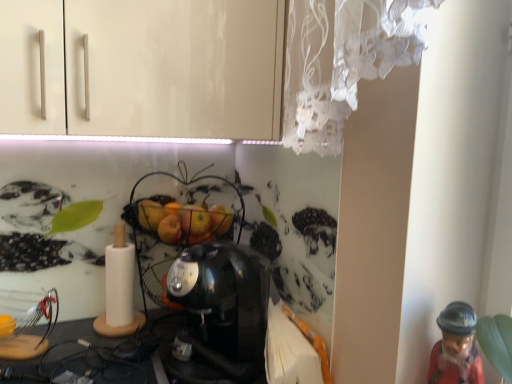
The width and height of the screenshot is (512, 384). What do you see at coordinates (205, 283) in the screenshot?
I see `metallic wire basket at center` at bounding box center [205, 283].

The width and height of the screenshot is (512, 384). Describe the element at coordinates (456, 347) in the screenshot. I see `red glossy figurine at lower right` at that location.

This screenshot has width=512, height=384. What are the coordinates of `metallic wire basket at center` in the screenshot? It's located at (x=205, y=283).

Is metallic wire basket at center oriented towards red glossy figurine at lower right?

Yes.

In the scene shown: Does metallic wire basket at center lie behind red glossy figurine at lower right?

Yes, metallic wire basket at center is behind red glossy figurine at lower right.

Does metallic wire basket at center have a larger size compared to red glossy figurine at lower right?

Yes.

What are the coordinates of `person on the right side of satin black coffee maker at center` in the screenshot? It's located at (456, 347).

Is point (471, 343) positioned in front of point (175, 271)?

That is True.

Is red glossy figurine at lower right located outside satin black coffee maker at center?

Absolutely, red glossy figurine at lower right is external to satin black coffee maker at center.

Considering the positions of objects red glossy figurine at lower right and satin black coffee maker at center in the image provided, who is in front, red glossy figurine at lower right or satin black coffee maker at center?

red glossy figurine at lower right is more forward.

Is satin black coffee maker at center facing towards red glossy figurine at lower right?

No, satin black coffee maker at center is not turned towards red glossy figurine at lower right.

Considering the relative sizes of satin black coffee maker at center and red glossy figurine at lower right in the image provided, is satin black coffee maker at center thinner than red glossy figurine at lower right?

No.

Is satin black coffee maker at center positioned beyond the bounds of red glossy figurine at lower right?

satin black coffee maker at center is positioned outside red glossy figurine at lower right.

Is satin black coffee maker at center taller than metallic wire basket at center?

In fact, satin black coffee maker at center may be shorter than metallic wire basket at center.

From the image's perspective, is satin black coffee maker at center below metallic wire basket at center?

Yes.

Is satin black coffee maker at center in front of or behind metallic wire basket at center in the image?

satin black coffee maker at center is in front of metallic wire basket at center.

Between red glossy figurine at lower right and metallic wire basket at center, which one has smaller width?

With smaller width is red glossy figurine at lower right.

Can you see red glossy figurine at lower right touching metallic wire basket at center?

No, red glossy figurine at lower right is not making contact with metallic wire basket at center.

Could you tell me if red glossy figurine at lower right is facing metallic wire basket at center?

No, red glossy figurine at lower right is not facing towards metallic wire basket at center.

Consider the image. Considering the positions of objects red glossy figurine at lower right and metallic wire basket at center in the image provided, who is more to the left, red glossy figurine at lower right or metallic wire basket at center?

Positioned to the left is metallic wire basket at center.

From the image's perspective, is metallic wire basket at center on top of satin black coffee maker at center?

Yes, from the image's perspective, metallic wire basket at center is above satin black coffee maker at center.

How many degrees apart are the facing directions of metallic wire basket at center and satin black coffee maker at center?

metallic wire basket at center and satin black coffee maker at center are facing 89.2 degrees away from each other.

Is the surface of metallic wire basket at center in direct contact with satin black coffee maker at center?

Yes, metallic wire basket at center is next to satin black coffee maker at center.

Considering the positions of objects metallic wire basket at center and satin black coffee maker at center in the image provided, who is more to the right, metallic wire basket at center or satin black coffee maker at center?

Positioned to the right is satin black coffee maker at center.

I want to click on toy that is above the red glossy figurine at lower right (from the image's perspective), so click(205, 283).

This screenshot has width=512, height=384. There is a satin black coffee maker at center. Find the location of `person above it (from a real-world perspective)`. person above it (from a real-world perspective) is located at coordinates click(x=456, y=347).

From the picture: When comparing their distances from satin black coffee maker at center, does metallic wire basket at center or red glossy figurine at lower right seem closer?

The object closer to satin black coffee maker at center is metallic wire basket at center.

Looking at the image, which one is located further to red glossy figurine at lower right, satin black coffee maker at center or metallic wire basket at center?

The object further to red glossy figurine at lower right is metallic wire basket at center.

Looking at the image, which one is located further to satin black coffee maker at center, red glossy figurine at lower right or metallic wire basket at center?

red glossy figurine at lower right is further to satin black coffee maker at center.

From the image, which object appears to be nearer to metallic wire basket at center, satin black coffee maker at center or red glossy figurine at lower right?

Based on the image, satin black coffee maker at center appears to be nearer to metallic wire basket at center.

Considering their positions, is red glossy figurine at lower right positioned further to metallic wire basket at center than satin black coffee maker at center?

red glossy figurine at lower right lies further to metallic wire basket at center than the other object.

Considering their positions, is metallic wire basket at center positioned further to red glossy figurine at lower right than satin black coffee maker at center?

The object further to red glossy figurine at lower right is metallic wire basket at center.

At what (x,y) coordinates should I click in order to perform the action: click on coffee maker between metallic wire basket at center and red glossy figurine at lower right. Please return your answer as a coordinate pair (x, y). Image resolution: width=512 pixels, height=384 pixels. Looking at the image, I should click on (223, 307).